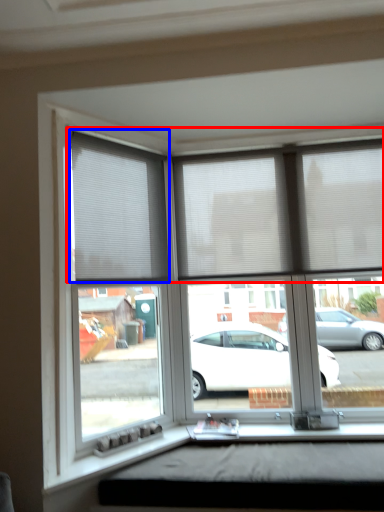
Question: Which object is closer to the camera taking this photo, blind (highlighted by a red box) or window blind (highlighted by a blue box)?

Choices:
 (A) blind
 (B) window blind

Answer: (B)